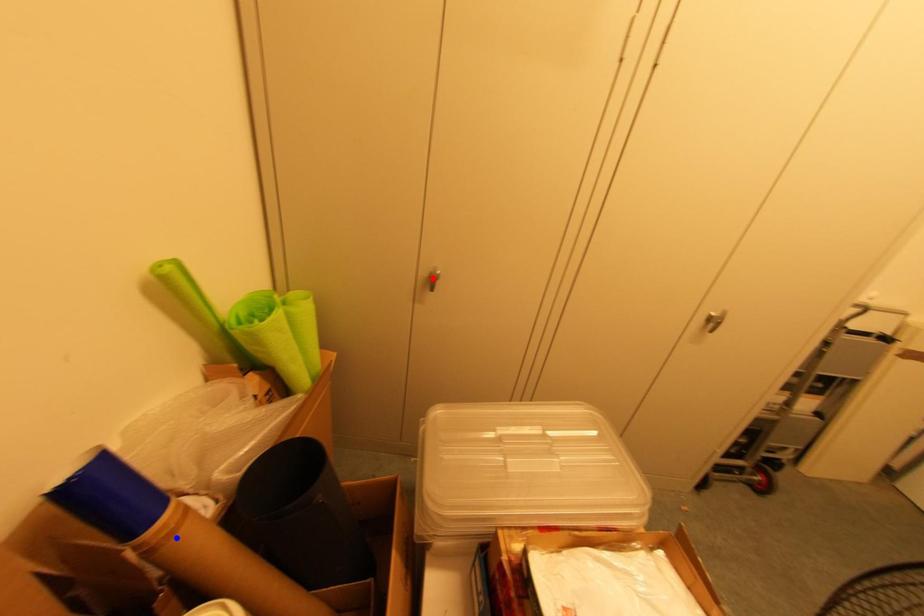
Question: Which of the two points in the image is closer to the camera?

Choices:
 (A) Blue point is closer.
 (B) Red point is closer.

Answer: (A)